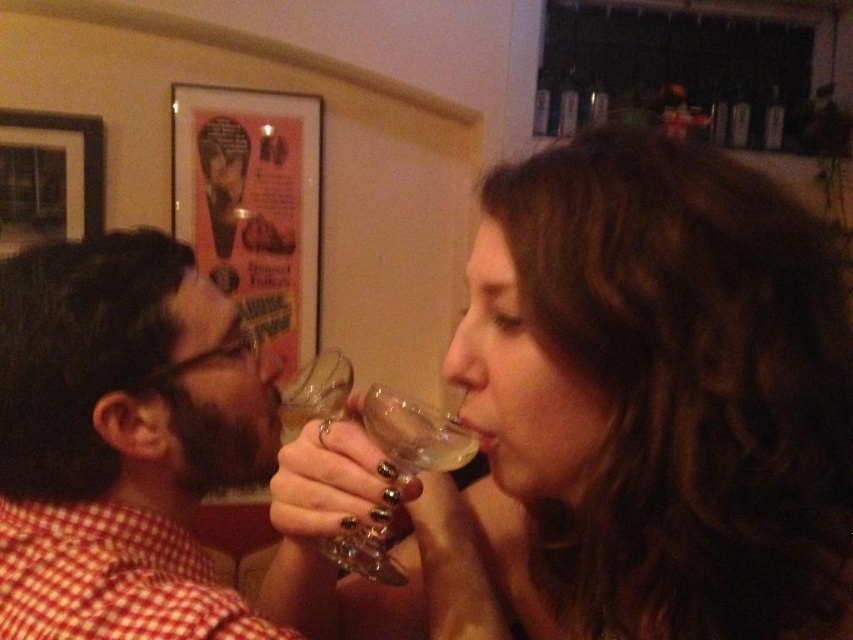
You are an interior designer assessing the placement of the brushed metal picture frame at upper left and the transparent glass at center in this dimly lit room. Based on their sizes, which object would cast a larger shadow on the wall behind them?

The brushed metal picture frame at upper left is much taller than the transparent glass at center, so it would cast a larger shadow on the wall behind them.